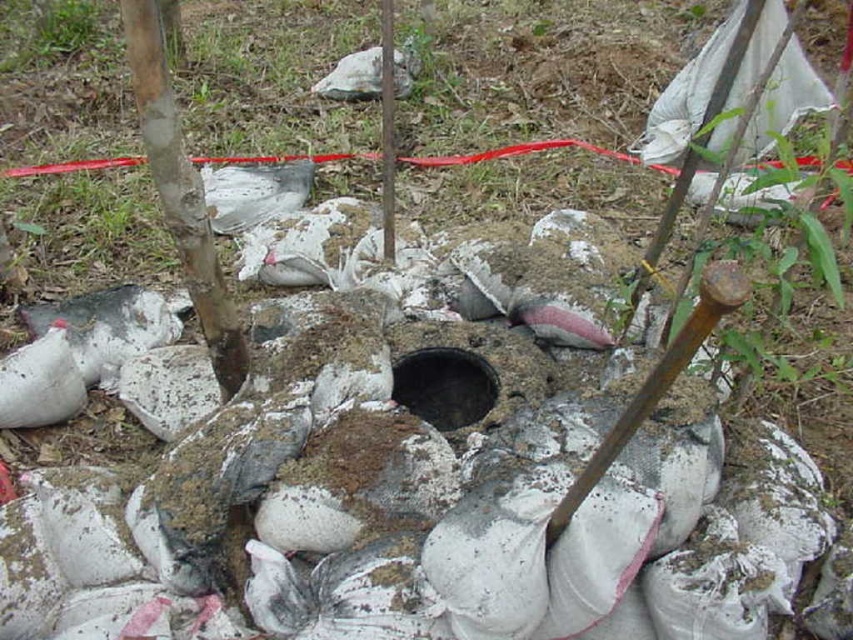
Can you confirm if smooth bark pole at center is positioned to the right of black concrete hole at center?

In fact, smooth bark pole at center is to the left of black concrete hole at center.

Measure the distance between point (229, 388) and camera.

The distance of point (229, 388) from camera is 7.48 feet.

Locate an element on the screen. smooth bark pole at center is located at coordinates (181, 193).

Between brown wooden shovel at center and black concrete hole at center, which one is positioned higher?

brown wooden shovel at center

Which of these two, brown wooden shovel at center or black concrete hole at center, stands taller?

With more height is brown wooden shovel at center.

Who is more forward, (653,406) or (466,378)?

Positioned in front is point (653,406).

Locate an element on the screen. brown wooden shovel at center is located at coordinates (656, 381).

Does brown wooden shovel at center have a greater width compared to brushed metal pole at center?

Indeed, brown wooden shovel at center has a greater width compared to brushed metal pole at center.

Between point (711, 308) and point (387, 132), which one is positioned behind?

The point (387, 132) is behind.

Locate an element on the screen. Image resolution: width=853 pixels, height=640 pixels. brown wooden shovel at center is located at coordinates (656, 381).